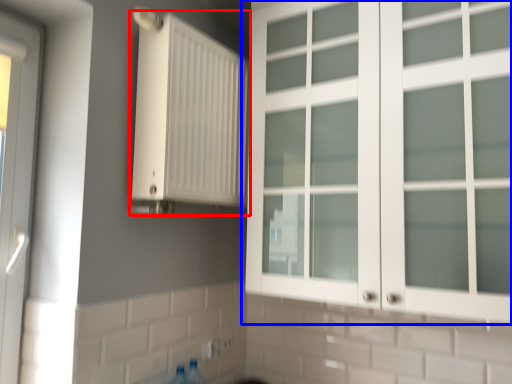
Question: Which point is closer to the camera, radiator (highlighted by a red box) or cupboard (highlighted by a blue box)?

Choices:
 (A) radiator
 (B) cupboard

Answer: (B)